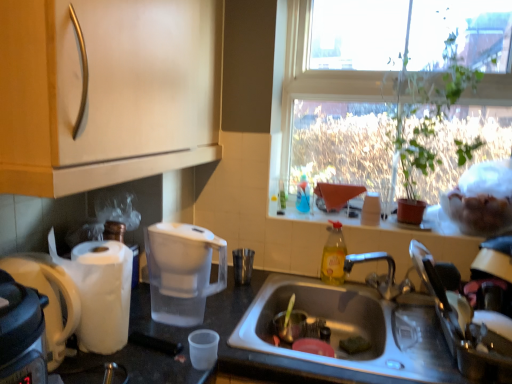
Image resolution: width=512 pixels, height=384 pixels. Find the location of `vacant space positioned to the left of yellow translucent bottle at sink, which is the first bottle in bottom-to-top order`. vacant space positioned to the left of yellow translucent bottle at sink, which is the first bottle in bottom-to-top order is located at coordinates (300, 281).